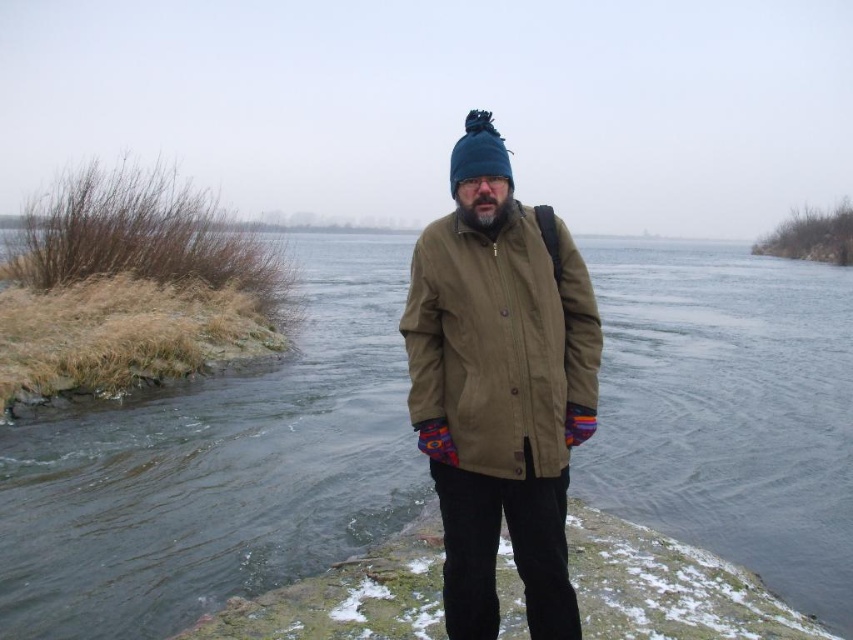
How far apart are olive-green fabric coat at center and blue fuzzy beanie at center?

They are 4.88 feet apart.

Who is higher up, olive-green fabric coat at center or blue fuzzy beanie at center?

blue fuzzy beanie at center

Describe the element at coordinates (500, 387) in the screenshot. The width and height of the screenshot is (853, 640). I see `olive-green fabric coat at center` at that location.

You are a GUI agent. You are given a task and a screenshot of the screen. Output one action in this format:
    pyautogui.click(x=<x>, y=<y>)
    Task: Click on the olive-green fabric coat at center
    The height and width of the screenshot is (640, 853).
    Given the screenshot: What is the action you would take?
    pyautogui.click(x=500, y=387)